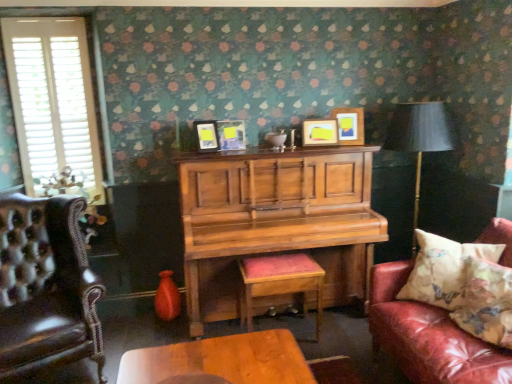
Question: Considering the relative sizes of matte wooden picture frame at upper center, positioned as the 2th picture frame in right-to-left order, and leather couch with floral pillow at right in the image provided, is matte wooden picture frame at upper center, positioned as the 2th picture frame in right-to-left order, shorter than leather couch with floral pillow at right?

Choices:
 (A) no
 (B) yes

Answer: (B)

Question: Does matte wooden picture frame at upper center, positioned as the 2th picture frame in right-to-left order, lie in front of leather couch with floral pillow at right?

Choices:
 (A) yes
 (B) no

Answer: (B)

Question: Is matte wooden picture frame at upper center, positioned as the 2th picture frame in right-to-left order, not close to leather couch with floral pillow at right?

Choices:
 (A) no
 (B) yes

Answer: (B)

Question: From a real-world perspective, is matte wooden picture frame at upper center, which appears as the 3th picture frame when viewed from the left, located higher than leather couch with floral pillow at right?

Choices:
 (A) no
 (B) yes

Answer: (B)

Question: Considering the relative positions of matte wooden picture frame at upper center, positioned as the 2th picture frame in right-to-left order, and leather couch with floral pillow at right in the image provided, is matte wooden picture frame at upper center, positioned as the 2th picture frame in right-to-left order, to the left of leather couch with floral pillow at right from the viewer's perspective?

Choices:
 (A) no
 (B) yes

Answer: (B)

Question: From the image's perspective, is matte wooden picture frame at upper center, positioned as the 2th picture frame in right-to-left order, beneath leather couch with floral pillow at right?

Choices:
 (A) yes
 (B) no

Answer: (B)

Question: Is wooden cushioned stool at center surrounding matte black lampshade at right?

Choices:
 (A) no
 (B) yes

Answer: (A)

Question: From the image's perspective, is wooden cushioned stool at center on top of matte black lampshade at right?

Choices:
 (A) yes
 (B) no

Answer: (B)

Question: Is wooden cushioned stool at center not close to matte black lampshade at right?

Choices:
 (A) yes
 (B) no

Answer: (A)

Question: Is wooden cushioned stool at center looking in the opposite direction of matte black lampshade at right?

Choices:
 (A) yes
 (B) no

Answer: (B)

Question: Is wooden cushioned stool at center wider than matte black lampshade at right?

Choices:
 (A) no
 (B) yes

Answer: (A)

Question: From the image's perspective, is wooden cushioned stool at center beneath matte black lampshade at right?

Choices:
 (A) no
 (B) yes

Answer: (B)

Question: Could you tell me if matte black picture frame at center, the first picture frame positioned from the left, is turned towards leather tufted armchair at left?

Choices:
 (A) no
 (B) yes

Answer: (A)